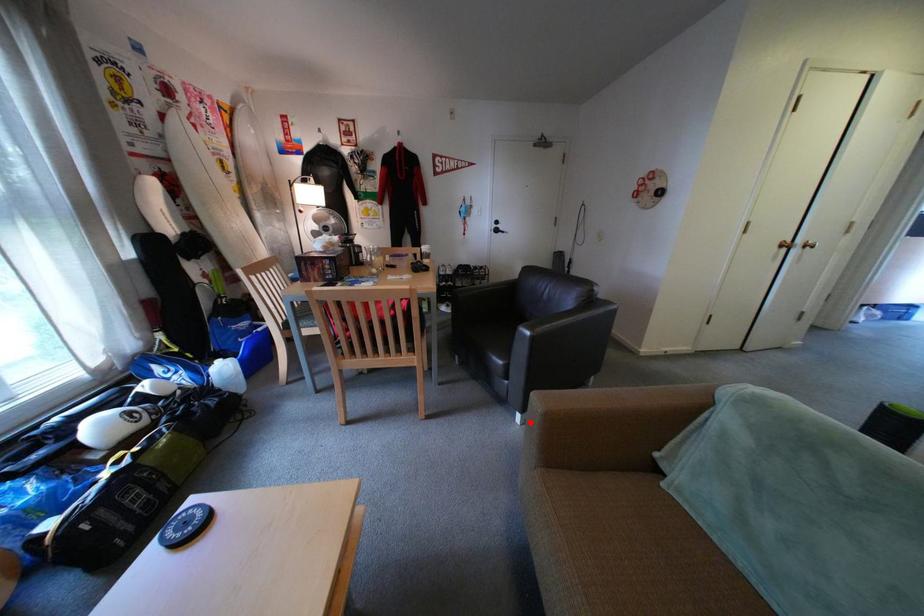
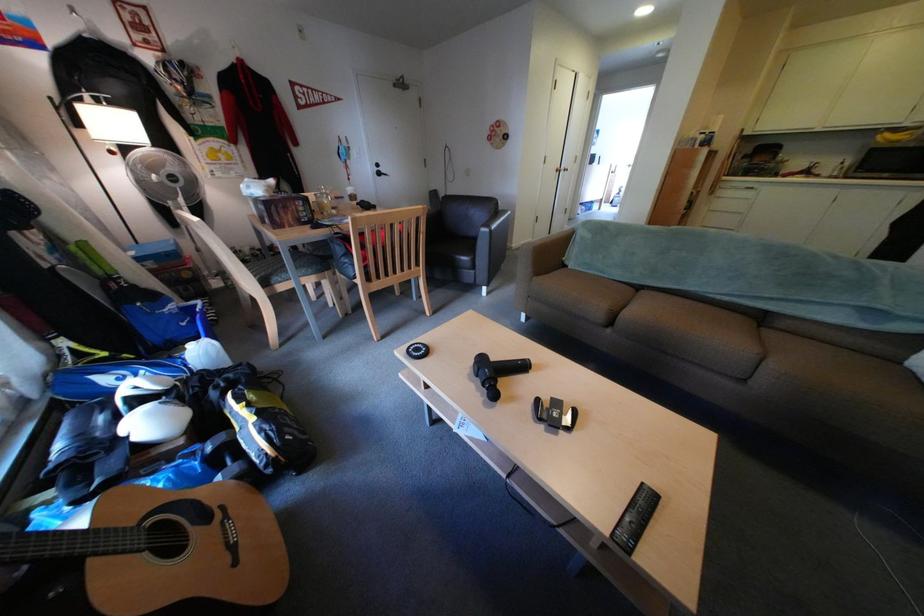
Question: A red point is marked in image1. In image2, is the corresponding 3D point closer to the camera or farther? Reply with the corresponding letter.

Choices:
 (A) The corresponding 3D point is closer.
 (B) The corresponding 3D point is farther.

Answer: (A)